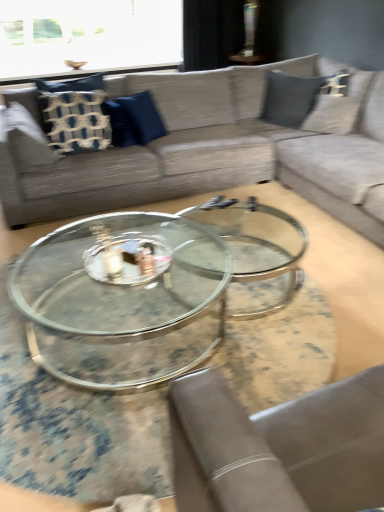
Question: From their relative heights in the image, would you say textured gray couch at upper center is taller or shorter than black fabric curtain at upper center?

Choices:
 (A) short
 (B) tall

Answer: (A)

Question: From a real-world perspective, is textured gray couch at upper center positioned above or below black fabric curtain at upper center?

Choices:
 (A) below
 (B) above

Answer: (A)

Question: Which is nearer to the clear glass window screen at upper center?

Choices:
 (A) blue woven pillow at left, which ranks as the 2th pillow in right-to-left order
 (B) black fabric curtain at upper center
 (C) blue fabric pillow at center, which ranks as the first pillow in right-to-left order
 (D) textured gray couch at upper center

Answer: (B)

Question: Which is farther from the black fabric curtain at upper center?

Choices:
 (A) textured gray couch at upper center
 (B) clear glass window screen at upper center
 (C) blue woven pillow at left, the first pillow viewed from the left
 (D) blue fabric pillow at center, which ranks as the first pillow in right-to-left order

Answer: (A)